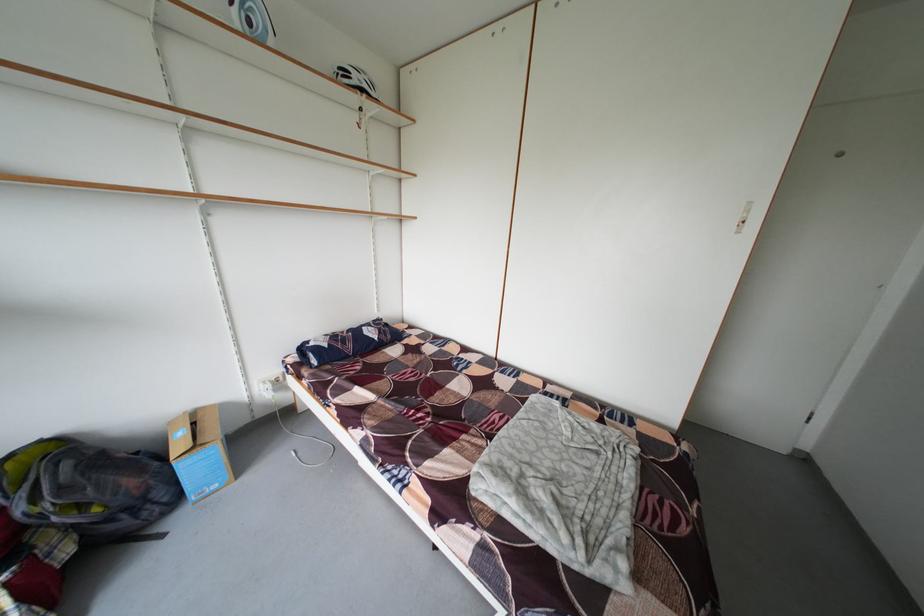
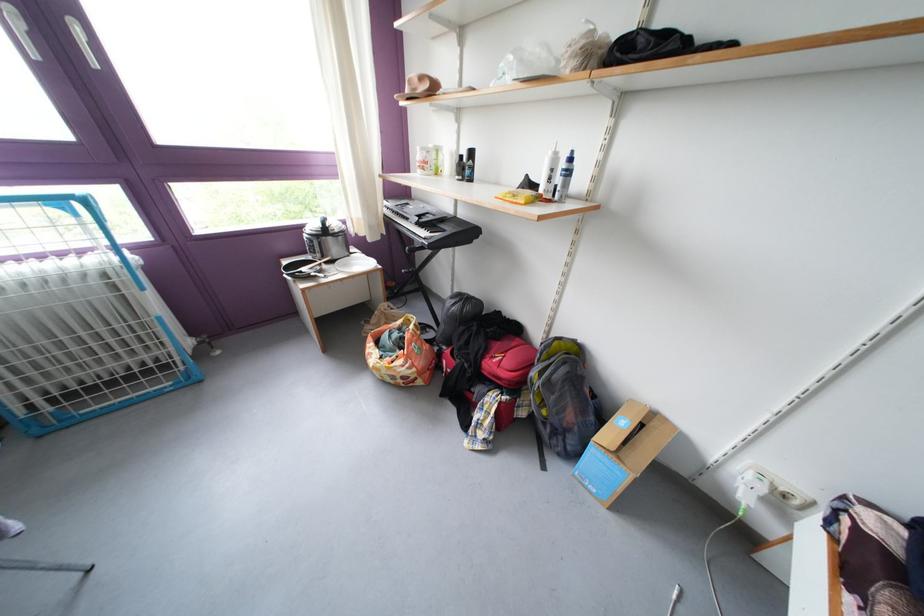
Find the pixel in the second image that matches point (181, 428) in the first image.

(641, 407)